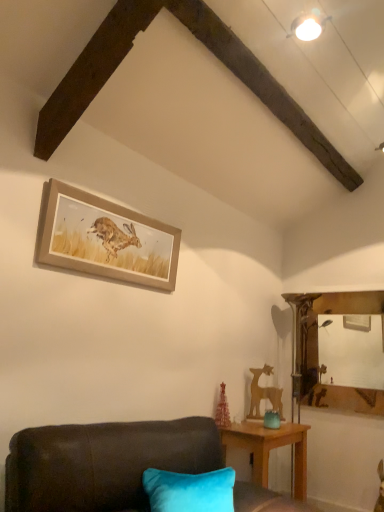
Identify the location of free point in front of teal glass jar at lower right. (272, 433).